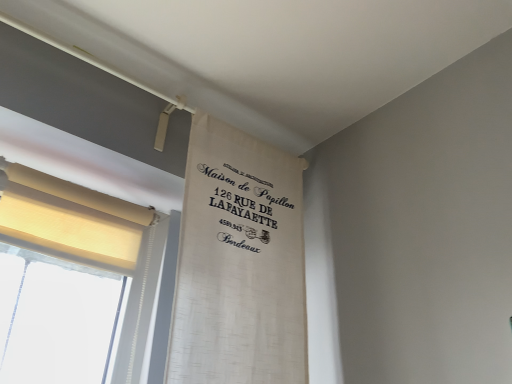
What is the approximate height of beige fabric curtain at left, arranged as the 2th curtain when viewed from the right?

It is 9.81 inches.

Describe the element at coordinates (70, 217) in the screenshot. I see `beige fabric curtain at left, which ranks as the first curtain in left-to-right order` at that location.

Find the location of a particular element. Image resolution: width=512 pixels, height=384 pixels. beige fabric curtain at left, arranged as the 2th curtain when viewed from the right is located at coordinates tap(70, 217).

What do you see at coordinates (239, 263) in the screenshot?
I see `white woven curtain at upper center, positioned as the first curtain in right-to-left order` at bounding box center [239, 263].

At what (x,y) coordinates should I click in order to perform the action: click on white woven curtain at upper center, the 2th curtain in the left-to-right sequence. Please return your answer as a coordinate pair (x, y). Looking at the image, I should click on (239, 263).

Measure the distance between white woven curtain at upper center, the 2th curtain in the left-to-right sequence, and camera.

white woven curtain at upper center, the 2th curtain in the left-to-right sequence, is 35.62 inches away from camera.

This screenshot has height=384, width=512. I want to click on beige fabric curtain at left, arranged as the 2th curtain when viewed from the right, so click(70, 217).

Between beige fabric curtain at left, which ranks as the first curtain in left-to-right order, and white woven curtain at upper center, positioned as the first curtain in right-to-left order, which one appears on the left side from the viewer's perspective?

beige fabric curtain at left, which ranks as the first curtain in left-to-right order.

Does beige fabric curtain at left, arranged as the 2th curtain when viewed from the right, come behind white woven curtain at upper center, positioned as the first curtain in right-to-left order?

Yes.

Is point (30, 230) closer or farther from the camera than point (225, 288)?

Clearly, point (30, 230) is closer to the camera than point (225, 288).

From the image's perspective, which object appears higher, beige fabric curtain at left, arranged as the 2th curtain when viewed from the right, or white woven curtain at upper center, positioned as the first curtain in right-to-left order?

From the image's view, beige fabric curtain at left, arranged as the 2th curtain when viewed from the right, is above.

From the picture: From a real-world perspective, who is located lower, beige fabric curtain at left, which ranks as the first curtain in left-to-right order, or white woven curtain at upper center, positioned as the first curtain in right-to-left order?

beige fabric curtain at left, which ranks as the first curtain in left-to-right order.

Considering the sizes of objects beige fabric curtain at left, arranged as the 2th curtain when viewed from the right, and white woven curtain at upper center, the 2th curtain in the left-to-right sequence, in the image provided, who is thinner, beige fabric curtain at left, arranged as the 2th curtain when viewed from the right, or white woven curtain at upper center, the 2th curtain in the left-to-right sequence,?

With smaller width is white woven curtain at upper center, the 2th curtain in the left-to-right sequence.

From the picture: Between beige fabric curtain at left, which ranks as the first curtain in left-to-right order, and white woven curtain at upper center, the 2th curtain in the left-to-right sequence, which one has less height?

With less height is beige fabric curtain at left, which ranks as the first curtain in left-to-right order.

Can you confirm if beige fabric curtain at left, which ranks as the first curtain in left-to-right order, is smaller than white woven curtain at upper center, the 2th curtain in the left-to-right sequence?

Correct, beige fabric curtain at left, which ranks as the first curtain in left-to-right order, occupies less space than white woven curtain at upper center, the 2th curtain in the left-to-right sequence.

Is beige fabric curtain at left, arranged as the 2th curtain when viewed from the right, outside of white woven curtain at upper center, the 2th curtain in the left-to-right sequence?

Yes, beige fabric curtain at left, arranged as the 2th curtain when viewed from the right, is not within white woven curtain at upper center, the 2th curtain in the left-to-right sequence.

Is beige fabric curtain at left, arranged as the 2th curtain when viewed from the right, far away from white woven curtain at upper center, positioned as the first curtain in right-to-left order?

No, beige fabric curtain at left, arranged as the 2th curtain when viewed from the right, is not far away from white woven curtain at upper center, positioned as the first curtain in right-to-left order.

Is beige fabric curtain at left, which ranks as the first curtain in left-to-right order, facing towards white woven curtain at upper center, positioned as the first curtain in right-to-left order?

No, beige fabric curtain at left, which ranks as the first curtain in left-to-right order, is not aimed at white woven curtain at upper center, positioned as the first curtain in right-to-left order.

Where is `curtain located behind the white woven curtain at upper center, positioned as the first curtain in right-to-left order`? The width and height of the screenshot is (512, 384). curtain located behind the white woven curtain at upper center, positioned as the first curtain in right-to-left order is located at coordinates (70, 217).

In the scene shown: Is white woven curtain at upper center, the 2th curtain in the left-to-right sequence, at the right side of beige fabric curtain at left, arranged as the 2th curtain when viewed from the right?

Correct, you'll find white woven curtain at upper center, the 2th curtain in the left-to-right sequence, to the right of beige fabric curtain at left, arranged as the 2th curtain when viewed from the right.

Considering the relative positions of white woven curtain at upper center, the 2th curtain in the left-to-right sequence, and beige fabric curtain at left, which ranks as the first curtain in left-to-right order, in the image provided, is white woven curtain at upper center, the 2th curtain in the left-to-right sequence, behind beige fabric curtain at left, which ranks as the first curtain in left-to-right order,?

No, white woven curtain at upper center, the 2th curtain in the left-to-right sequence, is closer to the camera.

Which is in front, point (304, 275) or point (18, 205)?

The point (18, 205) is more forward.

From the image's perspective, is white woven curtain at upper center, the 2th curtain in the left-to-right sequence, beneath beige fabric curtain at left, arranged as the 2th curtain when viewed from the right?

Yes.

From a real-world perspective, is white woven curtain at upper center, positioned as the first curtain in right-to-left order, under beige fabric curtain at left, arranged as the 2th curtain when viewed from the right?

No.

Looking at this image, which of these two, white woven curtain at upper center, the 2th curtain in the left-to-right sequence, or beige fabric curtain at left, which ranks as the first curtain in left-to-right order, is wider?

Wider between the two is beige fabric curtain at left, which ranks as the first curtain in left-to-right order.

Considering the relative sizes of white woven curtain at upper center, positioned as the first curtain in right-to-left order, and beige fabric curtain at left, arranged as the 2th curtain when viewed from the right, in the image provided, is white woven curtain at upper center, positioned as the first curtain in right-to-left order, shorter than beige fabric curtain at left, arranged as the 2th curtain when viewed from the right,?

In fact, white woven curtain at upper center, positioned as the first curtain in right-to-left order, may be taller than beige fabric curtain at left, arranged as the 2th curtain when viewed from the right.

Which of these two, white woven curtain at upper center, positioned as the first curtain in right-to-left order, or beige fabric curtain at left, which ranks as the first curtain in left-to-right order, is bigger?

With larger size is white woven curtain at upper center, positioned as the first curtain in right-to-left order.

Is white woven curtain at upper center, the 2th curtain in the left-to-right sequence, situated inside beige fabric curtain at left, which ranks as the first curtain in left-to-right order, or outside?

white woven curtain at upper center, the 2th curtain in the left-to-right sequence, is outside beige fabric curtain at left, which ranks as the first curtain in left-to-right order.

Is white woven curtain at upper center, positioned as the first curtain in right-to-left order, not near beige fabric curtain at left, arranged as the 2th curtain when viewed from the right?

No, there isn't a large distance between white woven curtain at upper center, positioned as the first curtain in right-to-left order, and beige fabric curtain at left, arranged as the 2th curtain when viewed from the right.

Is white woven curtain at upper center, the 2th curtain in the left-to-right sequence, aimed at beige fabric curtain at left, which ranks as the first curtain in left-to-right order?

No, white woven curtain at upper center, the 2th curtain in the left-to-right sequence, is not facing towards beige fabric curtain at left, which ranks as the first curtain in left-to-right order.

How many degrees apart are the facing directions of white woven curtain at upper center, the 2th curtain in the left-to-right sequence, and beige fabric curtain at left, arranged as the 2th curtain when viewed from the right?

0.0512 degrees separate the facing orientations of white woven curtain at upper center, the 2th curtain in the left-to-right sequence, and beige fabric curtain at left, arranged as the 2th curtain when viewed from the right.

Could you measure the distance between white woven curtain at upper center, the 2th curtain in the left-to-right sequence, and beige fabric curtain at left, arranged as the 2th curtain when viewed from the right?

A distance of 11.94 inches exists between white woven curtain at upper center, the 2th curtain in the left-to-right sequence, and beige fabric curtain at left, arranged as the 2th curtain when viewed from the right.

This screenshot has width=512, height=384. I want to click on curtain above the white woven curtain at upper center, positioned as the first curtain in right-to-left order (from the image's perspective), so click(x=70, y=217).

Image resolution: width=512 pixels, height=384 pixels. Find the location of `curtain below the white woven curtain at upper center, the 2th curtain in the left-to-right sequence (from a real-world perspective)`. curtain below the white woven curtain at upper center, the 2th curtain in the left-to-right sequence (from a real-world perspective) is located at coordinates (70, 217).

The height and width of the screenshot is (384, 512). Identify the location of curtain on the left of white woven curtain at upper center, positioned as the first curtain in right-to-left order. (70, 217).